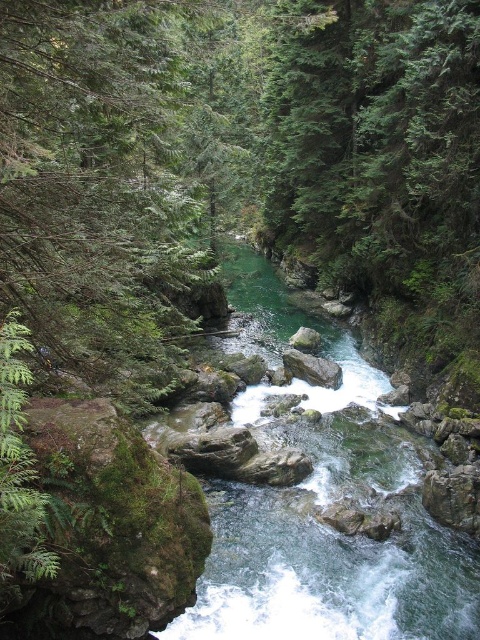
Can you confirm if green smooth water at center is wider than gray rock at center?

Yes.

Describe the element at coordinates (327, 577) in the screenshot. The height and width of the screenshot is (640, 480). I see `green smooth water at center` at that location.

Where is `green smooth water at center`? green smooth water at center is located at coordinates (327, 577).